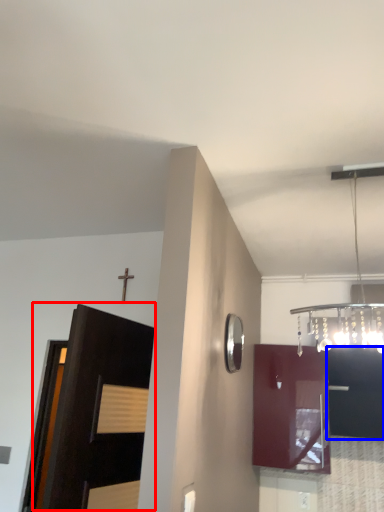
Question: Which object appears closest to the camera in this image, door (highlighted by a red box) or cabinetry (highlighted by a blue box)?

Choices:
 (A) door
 (B) cabinetry

Answer: (A)